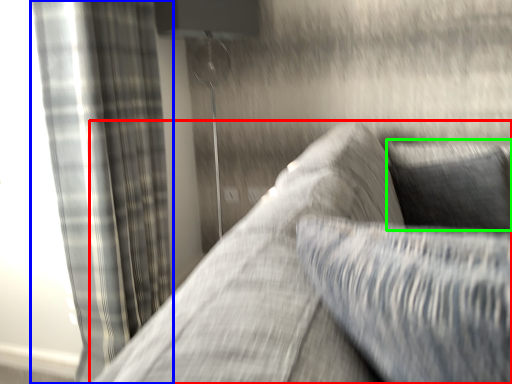
Question: Which is farther away from studio couch (highlighted by a red box)? curtain (highlighted by a blue box) or pillow (highlighted by a green box)?

Choices:
 (A) curtain
 (B) pillow

Answer: (A)